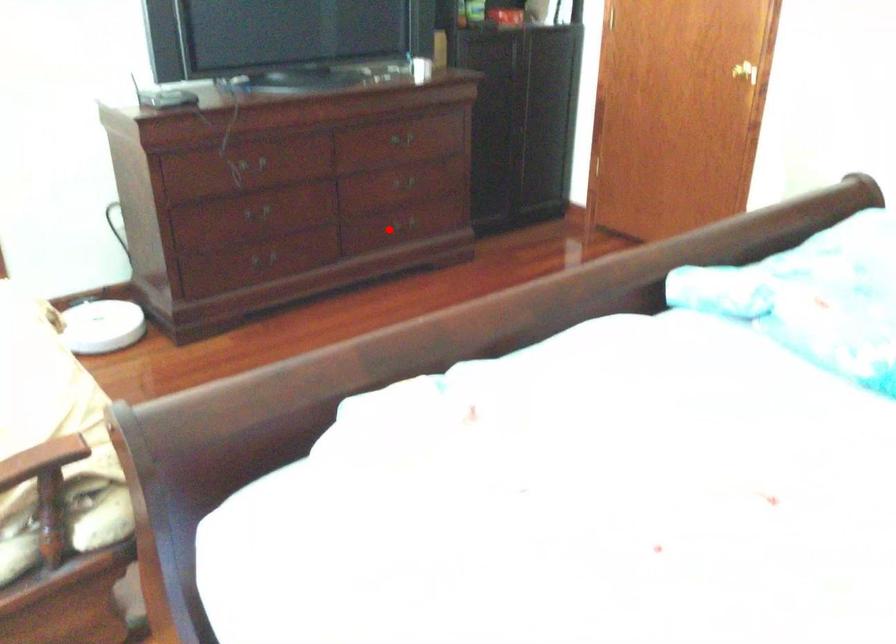
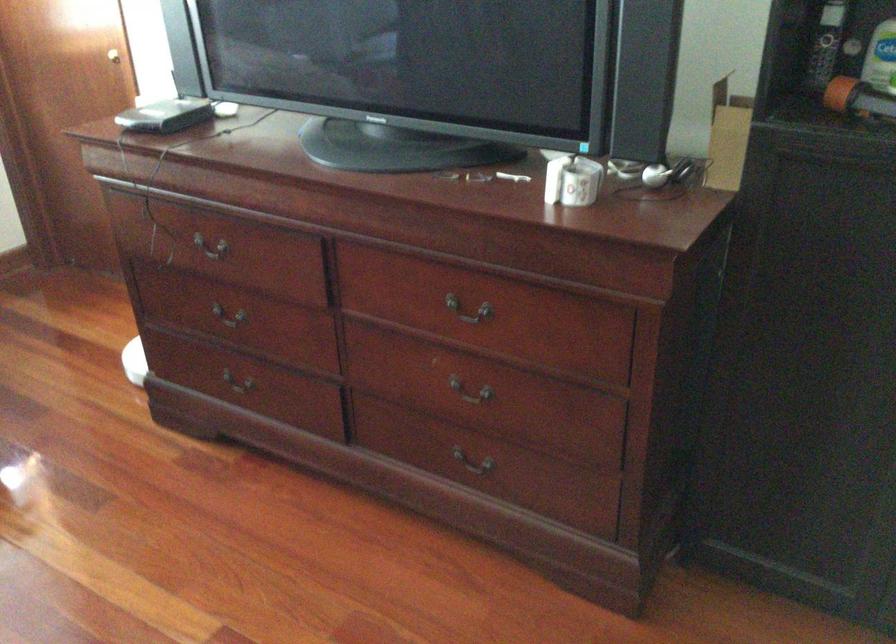
Question: A red point is marked in image1. In image2, is the corresponding 3D point closer to the camera or farther? Reply with the corresponding letter.

Choices:
 (A) The corresponding 3D point is closer.
 (B) The corresponding 3D point is farther.

Answer: (A)